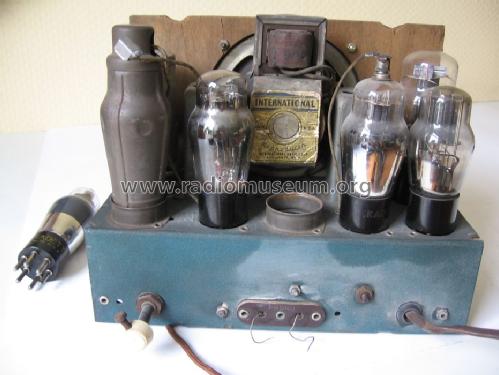
Locate an element on the screen. This screenshot has width=499, height=375. cable is located at coordinates (441, 330), (184, 345).